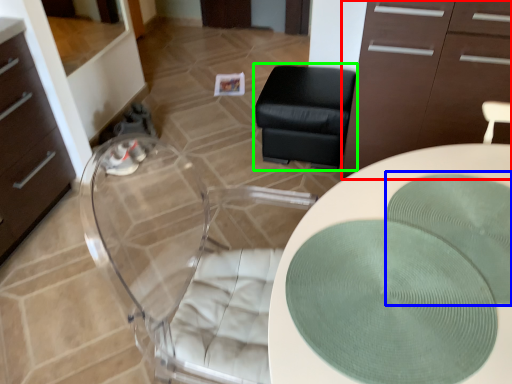
Question: Which object is positioned farthest from cabinetry (highlighted by a red box)? Select from mat (highlighted by a blue box) and furniture (highlighted by a green box).

Choices:
 (A) mat
 (B) furniture

Answer: (A)